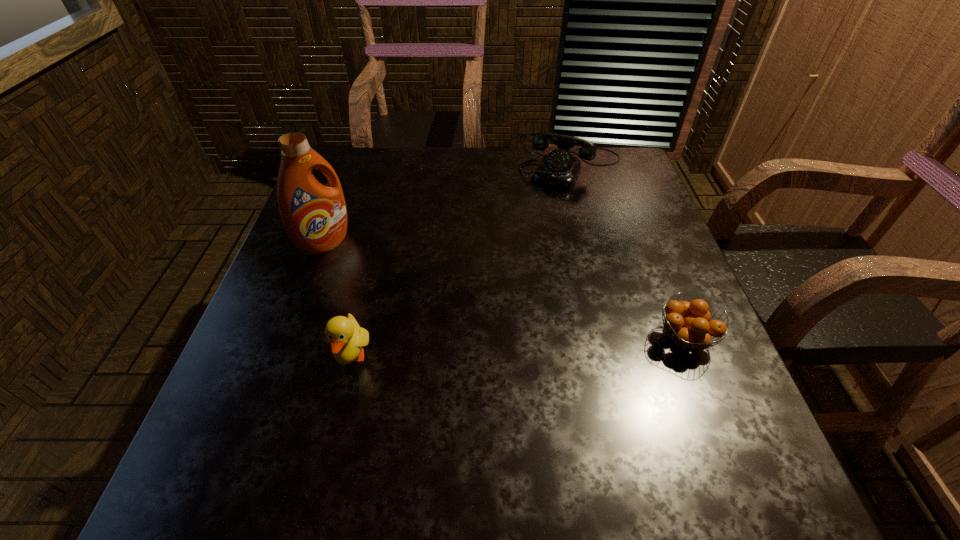
I want to click on the third object from right to left, so click(x=346, y=338).

Find the location of a particular element. This screenshot has width=960, height=540. the shortest object is located at coordinates (688, 323).

Where is `detergent`? The image size is (960, 540). detergent is located at coordinates (315, 215).

At what (x,y) coordinates should I click in order to perform the action: click on the third nearest object. Please return your answer as a coordinate pair (x, y). The height and width of the screenshot is (540, 960). Looking at the image, I should click on (315, 215).

This screenshot has width=960, height=540. I want to click on telephone, so click(x=559, y=168).

Locate an element on the screen. The image size is (960, 540). free spot located 0.070m on the front-facing side of the duckling is located at coordinates (337, 418).

Image resolution: width=960 pixels, height=540 pixels. Find the location of `vacant space located 0.250m on the back of the orange fruit`. vacant space located 0.250m on the back of the orange fruit is located at coordinates (644, 235).

Where is `free region located 0.280m on the front-facing side of the third nearest object`? This screenshot has width=960, height=540. free region located 0.280m on the front-facing side of the third nearest object is located at coordinates (428, 312).

Identify the location of vacant space located 0.390m on the front-facing side of the third nearest object. This screenshot has width=960, height=540. (469, 339).

The height and width of the screenshot is (540, 960). In order to click on vacant space situated 0.230m on the front-facing side of the third nearest object in this screenshot , I will do `click(411, 300)`.